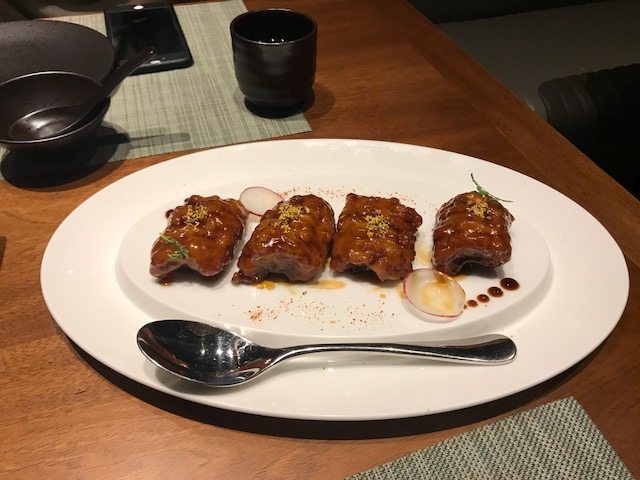
Identify the location of black spoon handle. (131, 64).